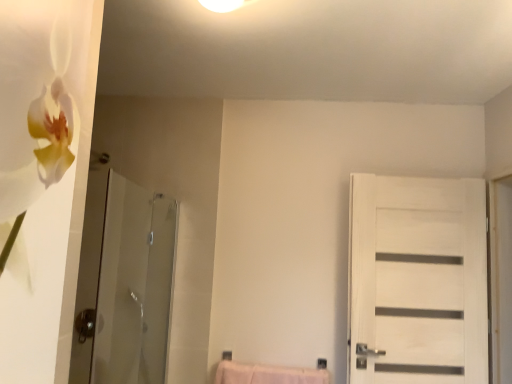
Question: From the image's perspective, is white wood door at right above or below transparent glass shower door at left?

Choices:
 (A) below
 (B) above

Answer: (A)

Question: Based on their sizes in the image, would you say white wood door at right is bigger or smaller than transparent glass shower door at left?

Choices:
 (A) small
 (B) big

Answer: (A)

Question: Is white wood door at right in front of or behind transparent glass shower door at left in the image?

Choices:
 (A) front
 (B) behind

Answer: (B)

Question: In terms of size, does transparent glass shower door at left appear bigger or smaller than white wood door at right?

Choices:
 (A) small
 (B) big

Answer: (B)

Question: Relative to white wood door at right, is transparent glass shower door at left in front or behind?

Choices:
 (A) front
 (B) behind

Answer: (A)

Question: From the image's perspective, is transparent glass shower door at left located above or below white wood door at right?

Choices:
 (A) below
 (B) above

Answer: (B)

Question: Does point (152, 240) appear closer or farther from the camera than point (369, 182)?

Choices:
 (A) closer
 (B) farther

Answer: (B)